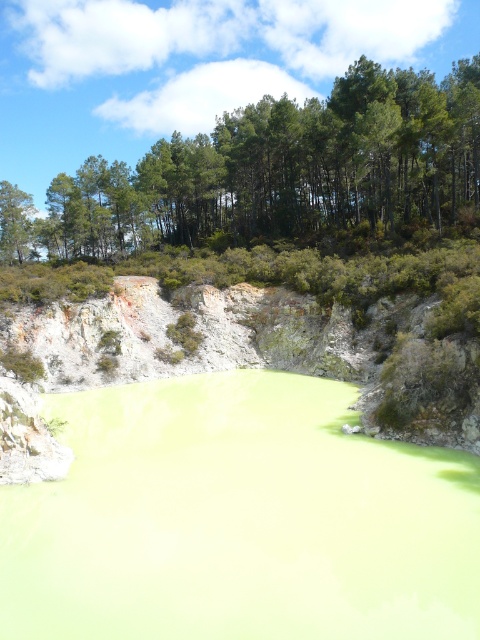
Looking at this image, you are standing at the point with coordinates point (379, 330) and want to walk to the point with coordinates point (280, 134). Will you be moving towards the geothermal pool or away from it?

Point (280, 134) is behind point (379, 330), so moving to it would mean walking away from the geothermal pool.

You are a hiker who wants to take a photo of the green liquid at center and the green leafy trees at upper center in the same frame. Based on their sizes, which object should you focus on first to ensure both are clearly visible in your photo?

The green liquid at center is smaller than the green leafy trees at upper center, so you should focus on the green leafy trees at upper center first to ensure both are clearly visible in your photo.